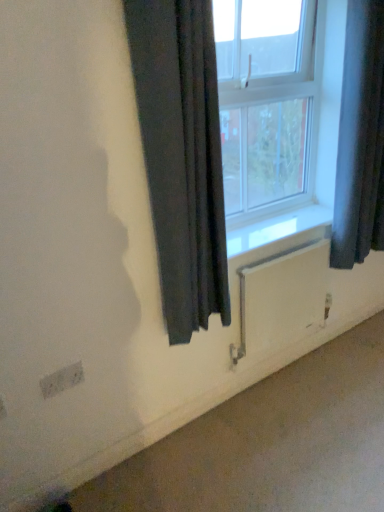
Question: Is dark fabric curtain at right, the second curtain from the left, next to white matte radiator at lower center and touching it?

Choices:
 (A) yes
 (B) no

Answer: (B)

Question: Is dark fabric curtain at right, acting as the 1th curtain starting from the right, turned away from white matte radiator at lower center?

Choices:
 (A) no
 (B) yes

Answer: (A)

Question: Considering the relative sizes of dark fabric curtain at right, acting as the 1th curtain starting from the right, and white matte radiator at lower center in the image provided, is dark fabric curtain at right, acting as the 1th curtain starting from the right, shorter than white matte radiator at lower center?

Choices:
 (A) no
 (B) yes

Answer: (A)

Question: Considering the relative positions of dark fabric curtain at right, the second curtain from the left, and white matte radiator at lower center in the image provided, is dark fabric curtain at right, the second curtain from the left, to the left of white matte radiator at lower center from the viewer's perspective?

Choices:
 (A) no
 (B) yes

Answer: (A)

Question: From the image's perspective, is dark fabric curtain at right, acting as the 1th curtain starting from the right, above white matte radiator at lower center?

Choices:
 (A) no
 (B) yes

Answer: (B)

Question: From the image's perspective, relative to dark fabric curtain at right, acting as the 1th curtain starting from the right, is white textured electric outlet at lower left above or below?

Choices:
 (A) below
 (B) above

Answer: (A)

Question: From a real-world perspective, relative to dark fabric curtain at right, acting as the 1th curtain starting from the right, is white textured electric outlet at lower left vertically above or below?

Choices:
 (A) below
 (B) above

Answer: (A)

Question: Does point (81, 374) appear closer or farther from the camera than point (367, 126)?

Choices:
 (A) farther
 (B) closer

Answer: (B)

Question: In the image, is white textured electric outlet at lower left positioned in front of or behind dark fabric curtain at right, the second curtain from the left?

Choices:
 (A) front
 (B) behind

Answer: (A)

Question: Considering the relative positions of dark fabric curtain at right, acting as the 1th curtain starting from the right, and white textured electric outlet at lower left in the image provided, is dark fabric curtain at right, acting as the 1th curtain starting from the right, to the left or to the right of white textured electric outlet at lower left?

Choices:
 (A) right
 (B) left

Answer: (A)

Question: From their relative heights in the image, would you say dark fabric curtain at right, the second curtain from the left, is taller or shorter than white textured electric outlet at lower left?

Choices:
 (A) tall
 (B) short

Answer: (A)

Question: From the image's perspective, relative to white textured electric outlet at lower left, is dark fabric curtain at right, acting as the 1th curtain starting from the right, above or below?

Choices:
 (A) above
 (B) below

Answer: (A)

Question: Choose the correct answer: Is dark fabric curtain at right, acting as the 1th curtain starting from the right, inside white textured electric outlet at lower left or outside it?

Choices:
 (A) outside
 (B) inside

Answer: (A)

Question: Is black fabric curtain at center, the second curtain in the right-to-left sequence, taller or shorter than dark fabric curtain at right, the second curtain from the left?

Choices:
 (A) short
 (B) tall

Answer: (A)

Question: Choose the correct answer: Is black fabric curtain at center, which appears as the 1th curtain when viewed from the left, inside dark fabric curtain at right, acting as the 1th curtain starting from the right, or outside it?

Choices:
 (A) inside
 (B) outside

Answer: (B)